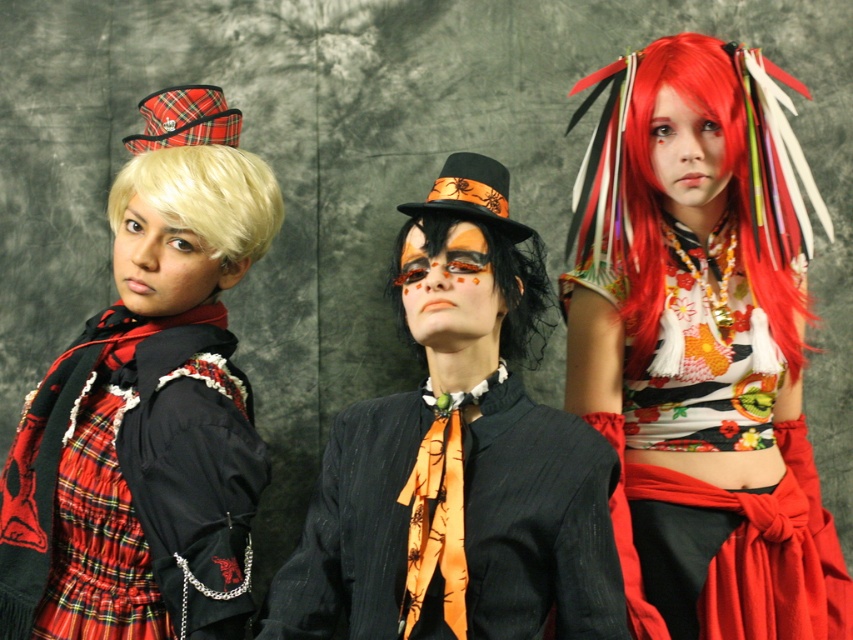
Looking at this image, is matte black suit at center bigger than black matte wig at center?

Yes, matte black suit at center is bigger than black matte wig at center.

Measure the distance between matte black suit at center and black matte wig at center.

matte black suit at center and black matte wig at center are 7.14 inches apart.

I want to click on matte black suit at center, so click(x=457, y=458).

Measure the distance between floral fabric top at center and matte black suit at center.

floral fabric top at center and matte black suit at center are 27.14 centimeters apart from each other.

Between floral fabric top at center and matte black suit at center, which one appears on the left side from the viewer's perspective?

From the viewer's perspective, matte black suit at center appears more on the left side.

Image resolution: width=853 pixels, height=640 pixels. Describe the element at coordinates (701, 349) in the screenshot. I see `floral fabric top at center` at that location.

You are a GUI agent. You are given a task and a screenshot of the screen. Output one action in this format:
    pyautogui.click(x=<x>, y=<y>)
    Task: Click on the floral fabric top at center
    
    Given the screenshot: What is the action you would take?
    pyautogui.click(x=701, y=349)

Based on the photo, does floral fabric top at center have a larger size compared to blonde synthetic wig at left?

Indeed, floral fabric top at center has a larger size compared to blonde synthetic wig at left.

Based on the photo, can you confirm if floral fabric top at center is smaller than blonde synthetic wig at left?

No.

The width and height of the screenshot is (853, 640). In order to click on floral fabric top at center in this screenshot , I will do `click(701, 349)`.